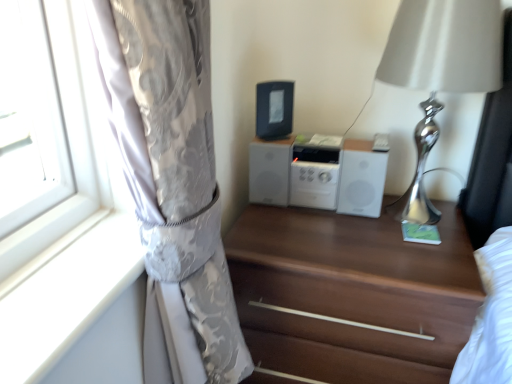
This screenshot has height=384, width=512. I want to click on brown wood chest of drawers at center, so click(350, 296).

The height and width of the screenshot is (384, 512). What do you see at coordinates (274, 109) in the screenshot? I see `black plastic radio at center` at bounding box center [274, 109].

The width and height of the screenshot is (512, 384). What do you see at coordinates (440, 72) in the screenshot?
I see `silver metallic table lamp at right` at bounding box center [440, 72].

Locate an element on the screen. This screenshot has height=384, width=512. silver metallic table lamp at right is located at coordinates (440, 72).

Where is `silky silver curtain at left`? silky silver curtain at left is located at coordinates (172, 183).

What do you see at coordinates (319, 173) in the screenshot? This screenshot has width=512, height=384. I see `white matte stereo at center` at bounding box center [319, 173].

Find the location of `brown wood chest of drawers at center`. brown wood chest of drawers at center is located at coordinates (350, 296).

Is point (282, 101) less distant than point (369, 176)?

That is False.

Is black plastic radio at center completely or partially outside of white matte stereo at center?

Yes, black plastic radio at center is located beyond the bounds of white matte stereo at center.

Is black plastic radio at center at the right side of white matte stereo at center?

Incorrect, black plastic radio at center is not on the right side of white matte stereo at center.

Between black plastic radio at center and white matte stereo at center, which one has smaller size?

With smaller size is black plastic radio at center.

Which of these two, black plastic radio at center or brown wood chest of drawers at center, stands shorter?

With less height is black plastic radio at center.

Is brown wood chest of drawers at center located within black plastic radio at center?

No, black plastic radio at center does not contain brown wood chest of drawers at center.

Which is closer, (288, 126) or (401, 345)?

The point (401, 345) is closer.

Considering the sizes of objects black plastic radio at center and brown wood chest of drawers at center in the image provided, who is wider, black plastic radio at center or brown wood chest of drawers at center?

With larger width is brown wood chest of drawers at center.

Between point (374, 176) and point (282, 97), which one is positioned in front?

The point (374, 176) is closer.

Does white matte stereo at center have a larger size compared to black plastic radio at center?

Yes, white matte stereo at center is bigger than black plastic radio at center.

Find the location of a particular element. This screenshot has height=384, width=512. appliance above the silver metallic table lamp at right (from the image's perspective) is located at coordinates (x=274, y=109).

From the image's perspective, between black plastic radio at center and silver metallic table lamp at right, which one is located above?

black plastic radio at center is shown above in the image.

Considering the positions of point (264, 115) and point (486, 65), is point (264, 115) closer or farther from the camera than point (486, 65)?

Point (264, 115) appears to be farther away from the viewer than point (486, 65).

Is black plastic radio at center not inside silver metallic table lamp at right?

That's correct, black plastic radio at center is outside of silver metallic table lamp at right.

Considering the sizes of objects silver metallic table lamp at right and black plastic radio at center in the image provided, who is smaller, silver metallic table lamp at right or black plastic radio at center?

Smaller between the two is black plastic radio at center.

Would you consider silver metallic table lamp at right to be distant from black plastic radio at center?

They are positioned close to each other.

In the image, there is a black plastic radio at center. Where is `table lamp below it (from the image's perspective)`? The height and width of the screenshot is (384, 512). table lamp below it (from the image's perspective) is located at coordinates (440, 72).

Does silver metallic table lamp at right turn towards black plastic radio at center?

No.

From a real-world perspective, between silver metallic table lamp at right and silky silver curtain at left, who is vertically lower?

From a 3D spatial view, silky silver curtain at left is below.

The height and width of the screenshot is (384, 512). Identify the location of table lamp above the silky silver curtain at left (from the image's perspective). (440, 72).

Looking at this image, from their relative heights in the image, would you say silver metallic table lamp at right is taller or shorter than silky silver curtain at left?

Considering their sizes, silver metallic table lamp at right has less height than silky silver curtain at left.

Is point (424, 44) in front of point (167, 44)?

No, (424, 44) is further to viewer.

From a real-world perspective, is silky silver curtain at left on top of silver metallic table lamp at right?

No, from a real-world perspective, silky silver curtain at left is not above silver metallic table lamp at right.

Between silky silver curtain at left and silver metallic table lamp at right, which one appears on the right side from the viewer's perspective?

From the viewer's perspective, silver metallic table lamp at right appears more on the right side.

Is silky silver curtain at left wider than silver metallic table lamp at right?

No, silky silver curtain at left is not wider than silver metallic table lamp at right.

Between point (208, 322) and point (404, 50), which one is positioned behind?

Point (404, 50)

You are a GUI agent. You are given a task and a screenshot of the screen. Output one action in this format:
    pyautogui.click(x=<x>, y=<y>)
    Task: Click on the stereo lying below the black plastic radio at center (from the image's perspective)
    Image resolution: width=512 pixels, height=384 pixels.
    Given the screenshot: What is the action you would take?
    pyautogui.click(x=319, y=173)

Locate an element on the screen. the chest of drawers located in front of the black plastic radio at center is located at coordinates (350, 296).

From the image, which object appears to be nearer to silky silver curtain at left, brown wood chest of drawers at center or white matte stereo at center?

brown wood chest of drawers at center lies closer to silky silver curtain at left than the other object.

From the image, which object appears to be nearer to black plastic radio at center, white matte stereo at center or brown wood chest of drawers at center?

white matte stereo at center.

Considering their positions, is white matte stereo at center positioned further to silky silver curtain at left than brown wood chest of drawers at center?

Based on the image, white matte stereo at center appears to be further to silky silver curtain at left.

Estimate the real-world distances between objects in this image. Which object is further from silky silver curtain at left, silver metallic table lamp at right or brown wood chest of drawers at center?

silver metallic table lamp at right is positioned further to the anchor silky silver curtain at left.

From the image, which object appears to be farther from brown wood chest of drawers at center, silver metallic table lamp at right or black plastic radio at center?

black plastic radio at center is further to brown wood chest of drawers at center.

Which object lies nearer to the anchor point silver metallic table lamp at right, black plastic radio at center or white matte stereo at center?

The object closer to silver metallic table lamp at right is white matte stereo at center.

Considering their positions, is silky silver curtain at left positioned closer to white matte stereo at center than silver metallic table lamp at right?

silver metallic table lamp at right is positioned closer to the anchor white matte stereo at center.

Estimate the real-world distances between objects in this image. Which object is closer to brown wood chest of drawers at center, white matte stereo at center or silky silver curtain at left?

white matte stereo at center is closer to brown wood chest of drawers at center.

This screenshot has width=512, height=384. Find the location of `stereo positioned between silky silver curtain at left and black plastic radio at center from near to far`. stereo positioned between silky silver curtain at left and black plastic radio at center from near to far is located at coordinates (319, 173).

Locate an element on the screen. The height and width of the screenshot is (384, 512). stereo that lies between silver metallic table lamp at right and brown wood chest of drawers at center from top to bottom is located at coordinates (319, 173).

You are a GUI agent. You are given a task and a screenshot of the screen. Output one action in this format:
    pyautogui.click(x=<x>, y=<y>)
    Task: Click on the table lamp located between silky silver curtain at left and black plastic radio at center in the depth direction
    
    Given the screenshot: What is the action you would take?
    pyautogui.click(x=440, y=72)

You are a GUI agent. You are given a task and a screenshot of the screen. Output one action in this format:
    pyautogui.click(x=<x>, y=<y>)
    Task: Click on the chest of drawers between silky silver curtain at left and black plastic radio at center along the z-axis
    This screenshot has width=512, height=384.
    Given the screenshot: What is the action you would take?
    pyautogui.click(x=350, y=296)